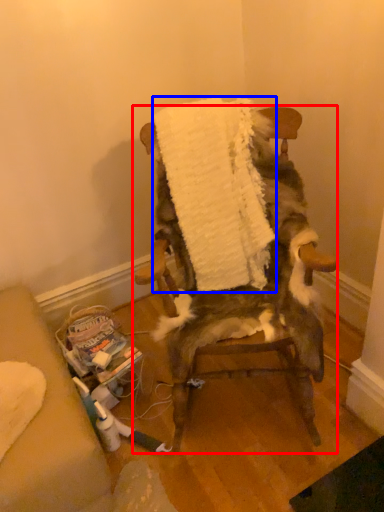
Question: Which point is further to the camera, chair (highlighted by a red box) or blanket (highlighted by a blue box)?

Choices:
 (A) chair
 (B) blanket

Answer: (B)